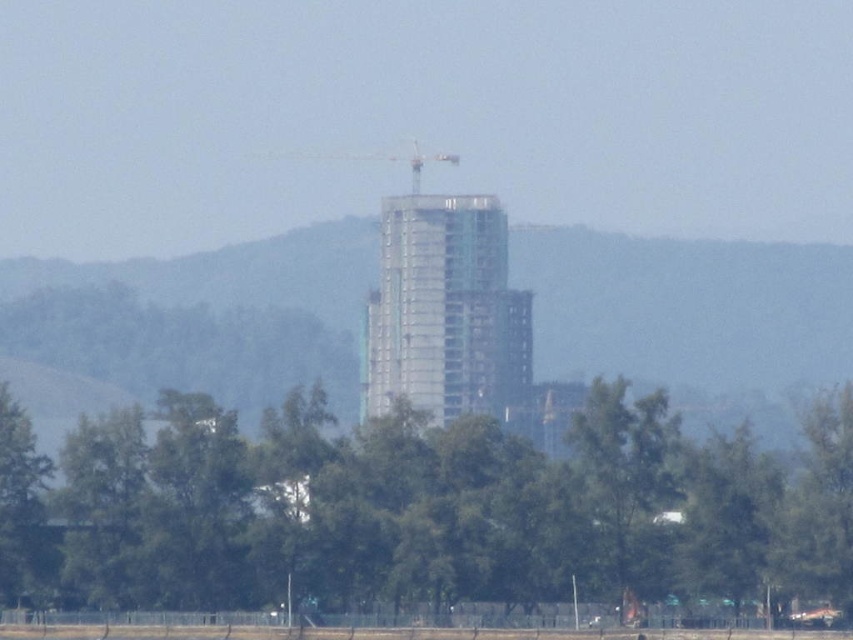
Question: Observing the image, what is the correct spatial positioning of clear glass building at center in reference to metallic gray crane at center?

Choices:
 (A) left
 (B) right

Answer: (B)

Question: Which of the following is the closest to the observer?

Choices:
 (A) (132, 426)
 (B) (405, 157)
 (C) (526, 339)

Answer: (A)

Question: Which point appears closest to the camera in this image?

Choices:
 (A) (238, 577)
 (B) (416, 161)
 (C) (444, 284)

Answer: (A)

Question: Which point is closer to the camera?

Choices:
 (A) (436, 157)
 (B) (440, 301)

Answer: (B)

Question: Observing the image, what is the correct spatial positioning of clear glass building at center in reference to metallic gray crane at center?

Choices:
 (A) right
 (B) left

Answer: (A)

Question: Does green leafy tree at lower center appear on the right side of clear glass building at center?

Choices:
 (A) no
 (B) yes

Answer: (A)